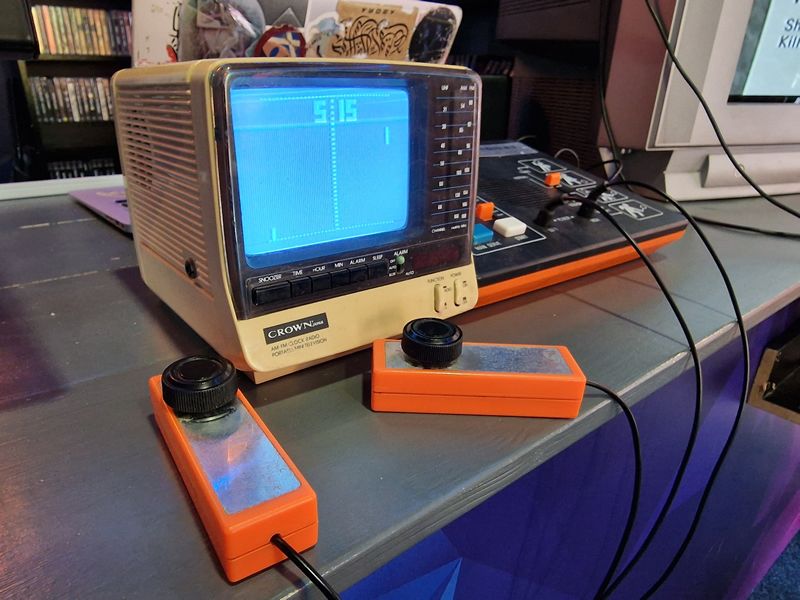
Locate an element on the screen. knob is located at coordinates (428, 342), (192, 394).